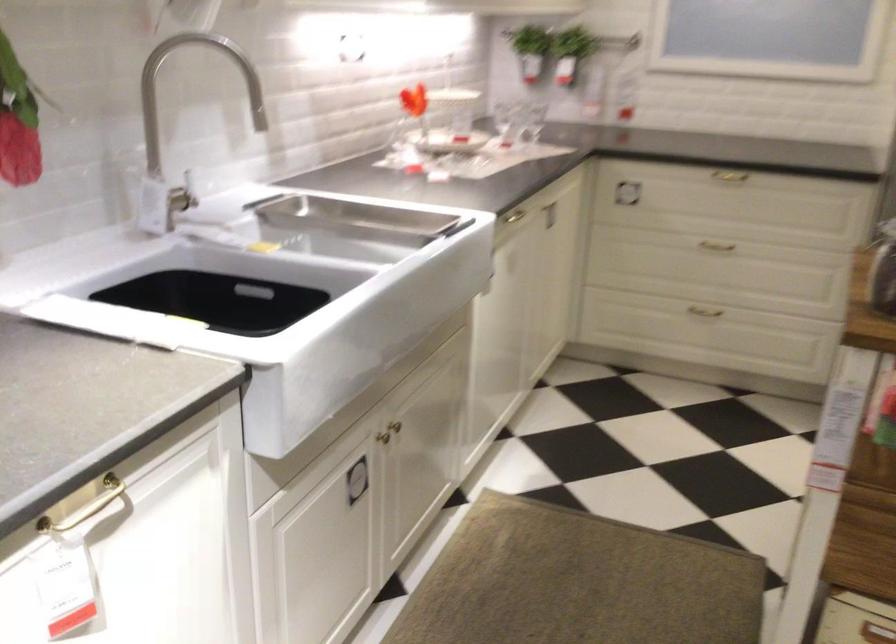
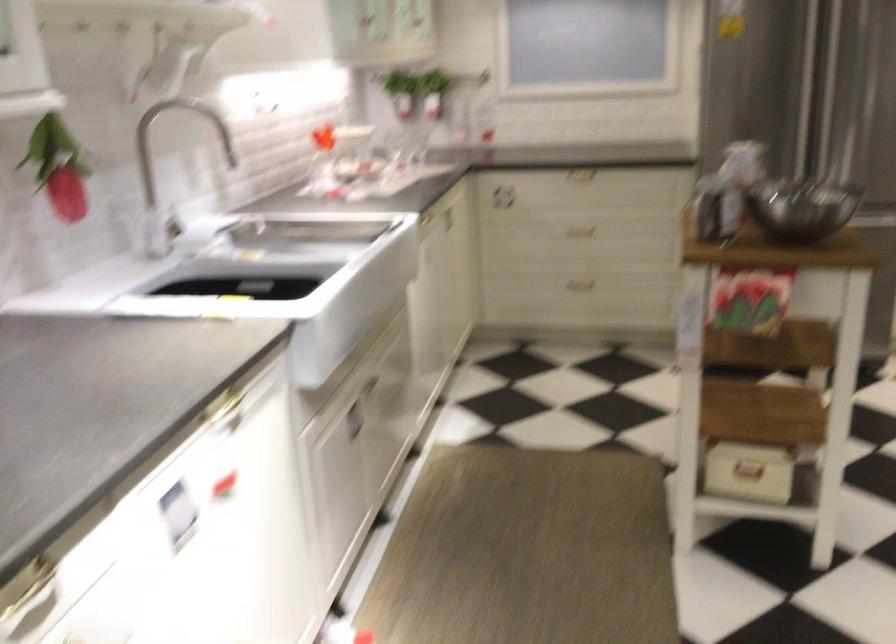
Which direction would the cameraman need to move to produce the second image?

The movement direction of the cameraman is left, backward.